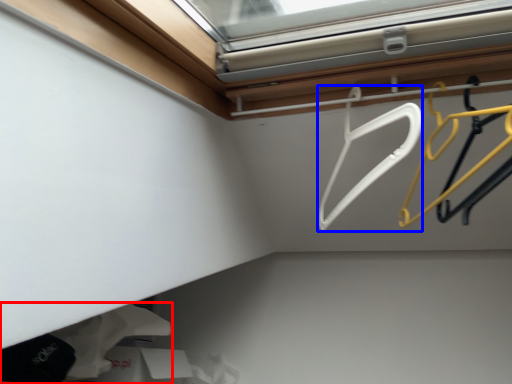
Question: Which object is further to the camera taking this photo, clothing (highlighted by a red box) or hanger (highlighted by a blue box)?

Choices:
 (A) clothing
 (B) hanger

Answer: (A)